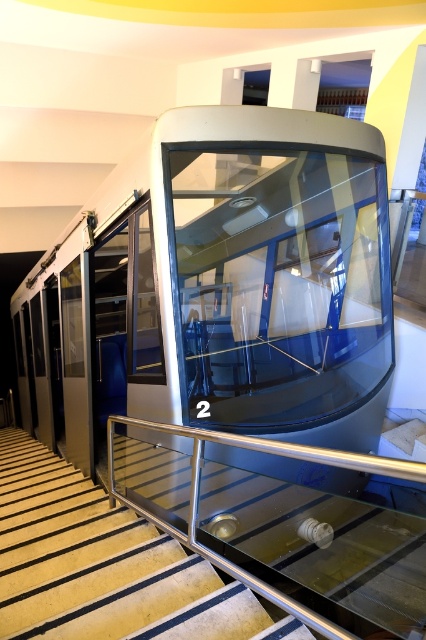
In the scene shown: Is transparent glass train at center above metallic glass stairs at center?

Correct, transparent glass train at center is located above metallic glass stairs at center.

Can you confirm if transparent glass train at center is wider than metallic glass stairs at center?

Indeed, transparent glass train at center has a greater width compared to metallic glass stairs at center.

Describe the element at coordinates (219, 288) in the screenshot. I see `transparent glass train at center` at that location.

The width and height of the screenshot is (426, 640). I want to click on transparent glass train at center, so click(x=219, y=288).